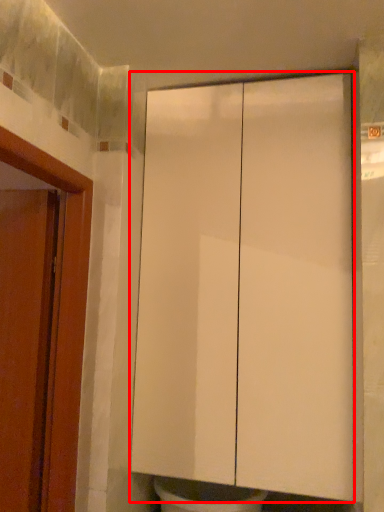
Question: Observing the image, what is the correct spatial positioning of cabinetry (annotated by the red box) in reference to door?

Choices:
 (A) right
 (B) left

Answer: (A)